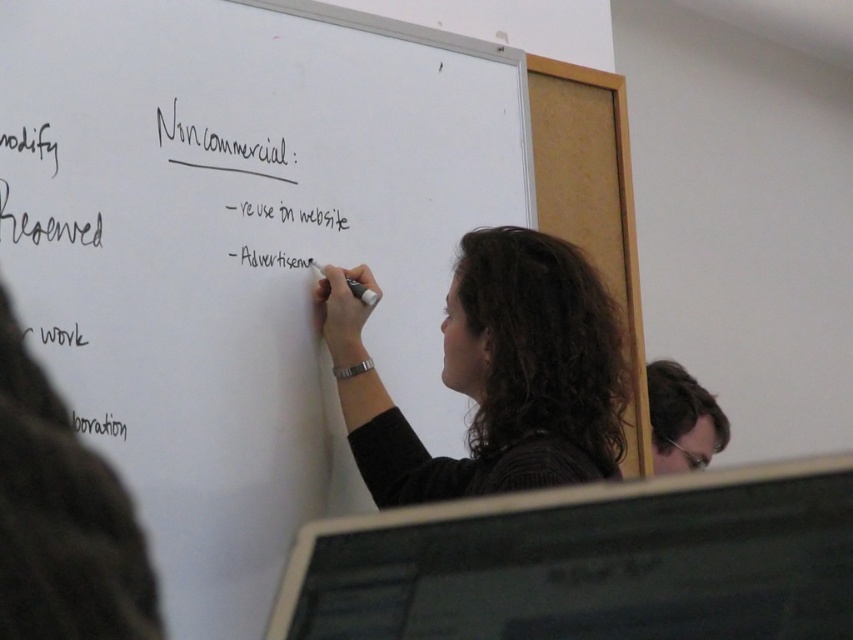
Question: Does black marker text at upper center appear on the left side of dark brown hair at lower right?

Choices:
 (A) yes
 (B) no

Answer: (A)

Question: Which object is the farthest from the dark brown hair at lower right?

Choices:
 (A) dark brown hair at center
 (B) white matte board at center
 (C) black marker text at upper center
 (D) black marker at left

Answer: (D)

Question: Is dark brown hair at center smaller than dark brown hair at lower right?

Choices:
 (A) yes
 (B) no

Answer: (B)

Question: Which object appears closest to the camera in this image?

Choices:
 (A) black marker text at upper center
 (B) white matte board at center

Answer: (B)

Question: Does black marker at left come behind black marker text at upper center?

Choices:
 (A) yes
 (B) no

Answer: (B)

Question: Which object is the farthest from the dark brown hair at lower right?

Choices:
 (A) dark brown hair at center
 (B) black marker at left
 (C) black marker text at upper center

Answer: (B)